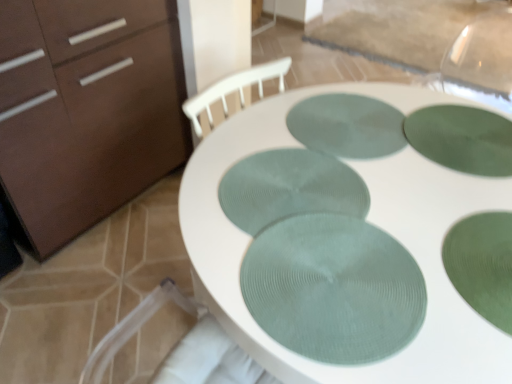
Find the location of a particular element. The image size is (512, 384). free space that is in between green textured placemat at center, which is the fifth glass plate in front-to-back order, and green textured glass plate at center, the third glass plate when ordered from front to back is located at coordinates (330, 160).